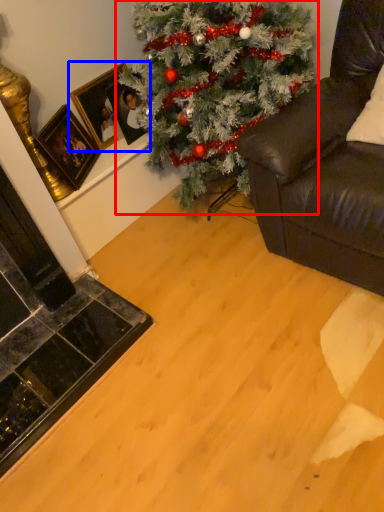
Question: Which point is closer to the camera, christmas tree (highlighted by a red box) or picture frame (highlighted by a blue box)?

Choices:
 (A) christmas tree
 (B) picture frame

Answer: (A)